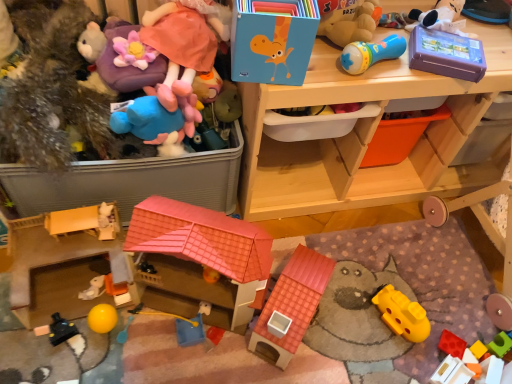
Locate an element on the screen. The width and height of the screenshot is (512, 384). vacant space that's between white plush toy at lower left, the twelfth toy from the right, and blue plastic toy at center, the 8th toy viewed from the left is located at coordinates coord(152,322).